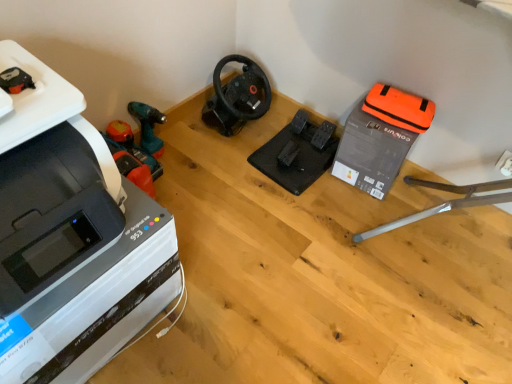
This screenshot has width=512, height=384. I want to click on free space to the left of black rubber pedals at center, which is the 1th equipment in left-to-right order, so pyautogui.click(x=218, y=167).